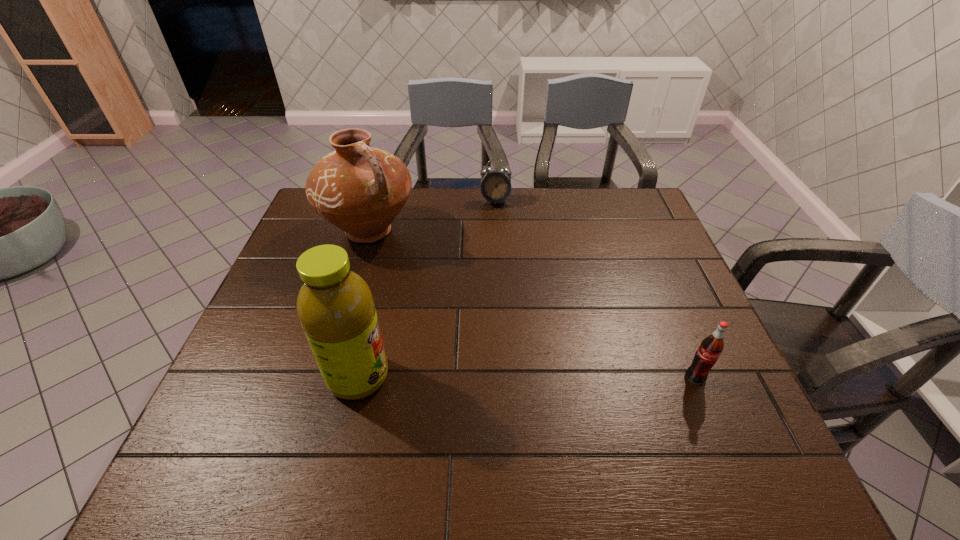
Image resolution: width=960 pixels, height=540 pixels. In order to click on vacant space located 0.220m on the face of the second object from right to left in this screenshot , I will do `click(497, 250)`.

Locate an element on the screen. The image size is (960, 540). free spot located 0.180m on the side of the pottery with the handle is located at coordinates (421, 291).

Find the location of a particular element. free space located 0.340m on the side of the pottery with the handle is located at coordinates (453, 328).

Image resolution: width=960 pixels, height=540 pixels. In order to click on vacant space located on the side of the pottery with the handle in this screenshot , I will do `click(455, 331)`.

Locate an element on the screen. This screenshot has height=540, width=960. alarm clock present at the far edge is located at coordinates (495, 187).

This screenshot has height=540, width=960. In order to click on pottery that is at the far edge in this screenshot , I will do [x=360, y=189].

At what (x,y) coordinates should I click in order to perform the action: click on object present at the near edge. Please return your answer as a coordinate pair (x, y). The image size is (960, 540). Looking at the image, I should click on (335, 306).

Find the location of a particular element. The width and height of the screenshot is (960, 540). object present at the left edge is located at coordinates (360, 189).

Identify the location of object at the right edge. (706, 356).

Find the location of a particular element. Image resolution: width=960 pixels, height=540 pixels. object that is at the far left corner is located at coordinates (360, 189).